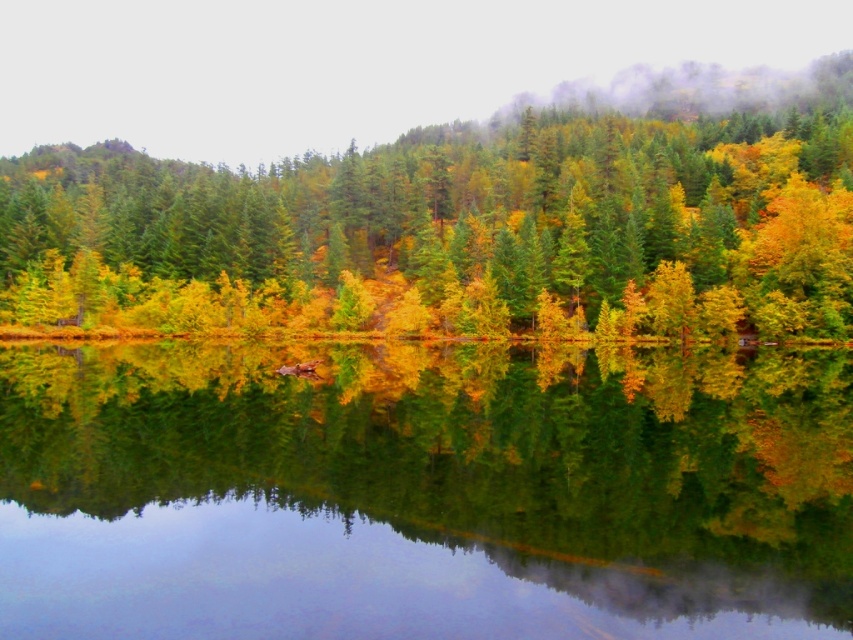
Based on the scene description, where is the transparent water at center located in terms of its 2D coordinates?

The transparent water at center is located at the 2D coordinates point (424, 492).